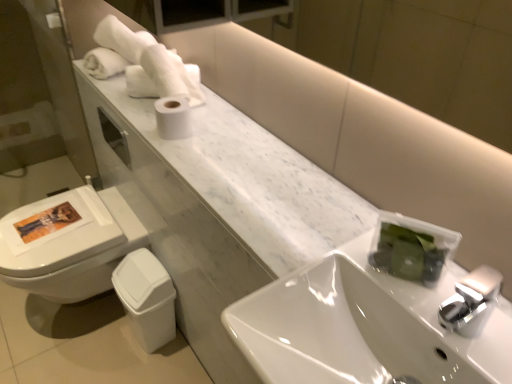
The height and width of the screenshot is (384, 512). I want to click on blank space situated above white marble counter at upper left (from a real-world perspective), so click(x=237, y=166).